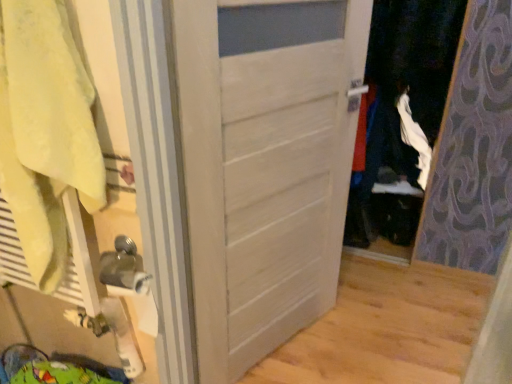
Question: Is point (18, 208) closer or farther from the camera than point (308, 160)?

Choices:
 (A) farther
 (B) closer

Answer: (B)

Question: From their relative heights in the image, would you say yellow cotton bath towel at left is taller or shorter than white matte door at center?

Choices:
 (A) tall
 (B) short

Answer: (B)

Question: From the image's perspective, is yellow cotton bath towel at left located above or below white matte door at center?

Choices:
 (A) below
 (B) above

Answer: (B)

Question: From their relative heights in the image, would you say white matte door at center is taller or shorter than yellow cotton bath towel at left?

Choices:
 (A) tall
 (B) short

Answer: (A)

Question: Considering their positions, is white matte door at center located in front of or behind yellow cotton bath towel at left?

Choices:
 (A) behind
 (B) front

Answer: (A)

Question: From the image's perspective, is white matte door at center positioned above or below yellow cotton bath towel at left?

Choices:
 (A) above
 (B) below

Answer: (B)

Question: From a real-world perspective, relative to yellow cotton bath towel at left, is white matte door at center vertically above or below?

Choices:
 (A) below
 (B) above

Answer: (A)